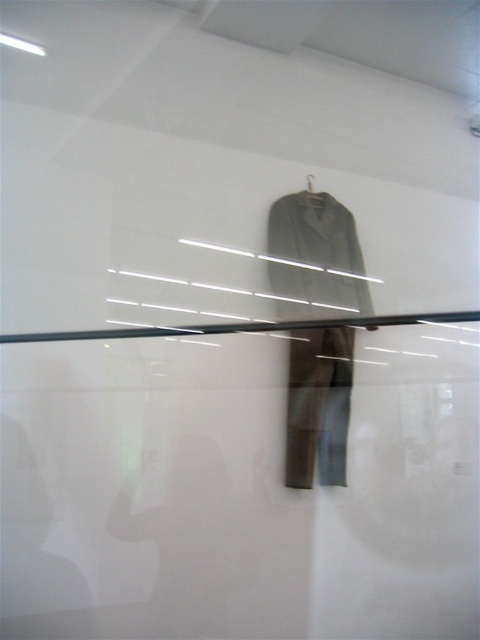
Question: Which object is positioned farthest from the gray fabric jacket at center?

Choices:
 (A) metallic silver hanger at upper center
 (B) transparent glass door at center

Answer: (B)

Question: Is transparent glass door at center below gray fabric jacket at center?

Choices:
 (A) no
 (B) yes

Answer: (B)

Question: Is transparent glass door at center in front of dark gray fabric suit at center?

Choices:
 (A) yes
 (B) no

Answer: (A)

Question: Is transparent glass door at center thinner than gray fabric jacket at center?

Choices:
 (A) yes
 (B) no

Answer: (B)

Question: Which object is farther from the camera taking this photo?

Choices:
 (A) gray fabric jacket at center
 (B) metallic silver hanger at upper center
 (C) transparent glass door at center
 (D) dark gray fabric suit at center

Answer: (B)

Question: Estimate the real-world distances between objects in this image. Which object is farther from the gray fabric jacket at center?

Choices:
 (A) transparent glass door at center
 (B) dark gray fabric suit at center

Answer: (A)